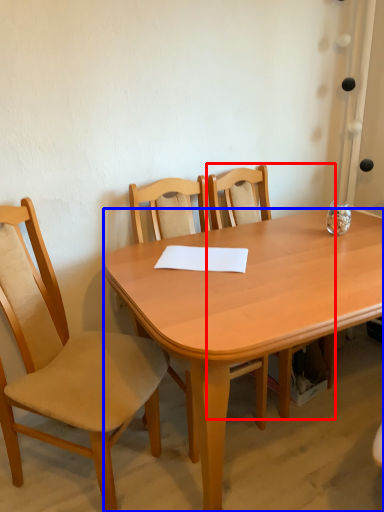
Question: Which object is closer to the camera taking this photo, chair (highlighted by a red box) or desk (highlighted by a blue box)?

Choices:
 (A) chair
 (B) desk

Answer: (B)